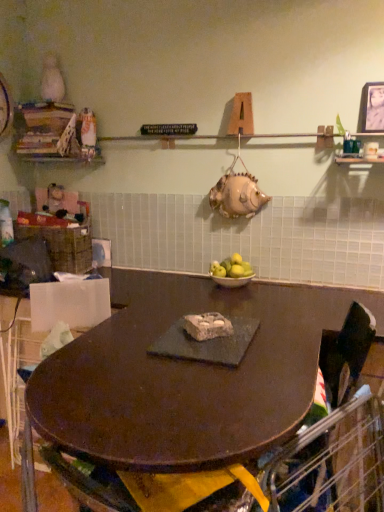
Question: From the image's perspective, is dark brown wood table at center located above or below metallic silver photo frame at upper right?

Choices:
 (A) below
 (B) above

Answer: (A)

Question: Is dark brown wood table at center situated inside metallic silver photo frame at upper right or outside?

Choices:
 (A) inside
 (B) outside

Answer: (B)

Question: Which object is positioned closest to the woven brown basket at left?

Choices:
 (A) dark brown wood table at center
 (B) yellow matte apples at center
 (C) black fabric swivel chair at center
 (D) wooden books at upper left
 (E) metallic silver photo frame at upper right

Answer: (D)

Question: Which object is positioned closest to the metallic silver photo frame at upper right?

Choices:
 (A) black fabric swivel chair at center
 (B) woven brown basket at left
 (C) dark brown wood table at center
 (D) wooden books at upper left
 (E) yellow matte apples at center

Answer: (E)